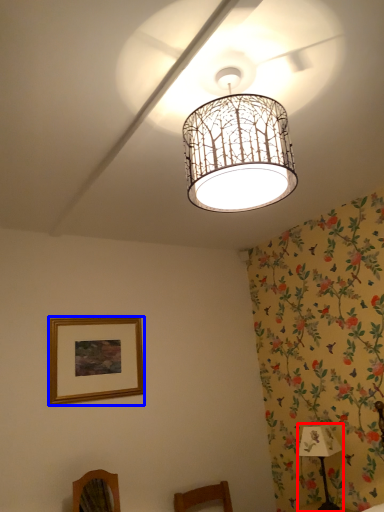
Question: Which of the following is the farthest to the observer, table lamp (highlighted by a red box) or picture frame (highlighted by a blue box)?

Choices:
 (A) table lamp
 (B) picture frame

Answer: (B)